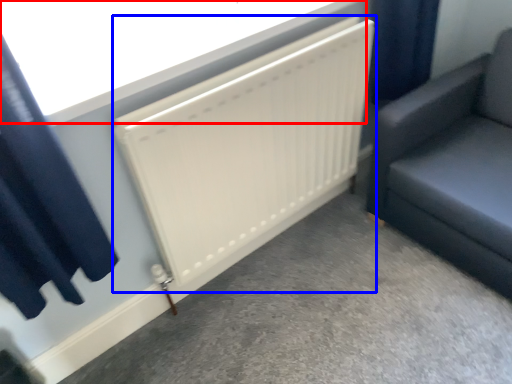
Question: Which of the following is the farthest to the observer, window screen (highlighted by a red box) or radiator (highlighted by a blue box)?

Choices:
 (A) window screen
 (B) radiator

Answer: (B)